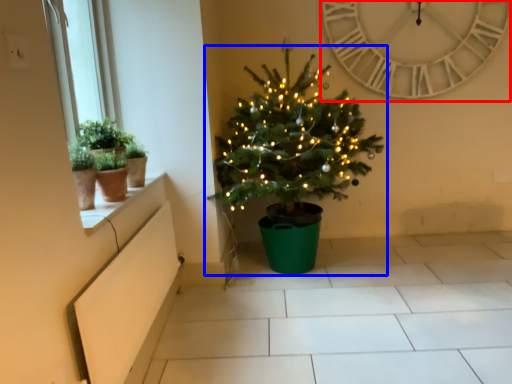
Question: Which of the following is the farthest to the observer, clock (highlighted by a red box) or christmas tree (highlighted by a blue box)?

Choices:
 (A) clock
 (B) christmas tree

Answer: (A)